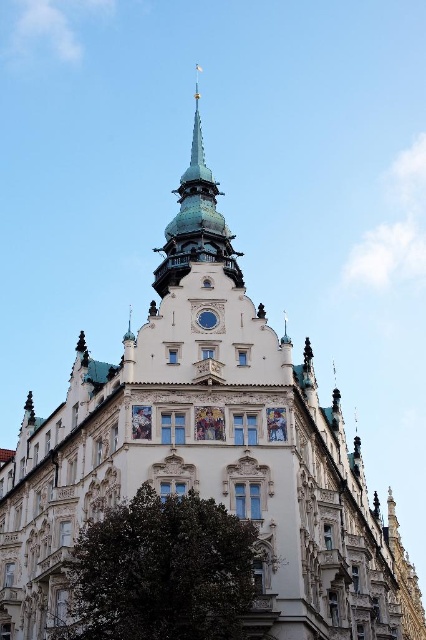
Question: Which object appears farthest from the camera in this image?

Choices:
 (A) blue glass clock at center
 (B) green metallic spire at upper center

Answer: (B)

Question: Which point is closer to the camera?

Choices:
 (A) green metallic spire at upper center
 (B) blue glass clock at center

Answer: (B)

Question: In this image, where is green metallic spire at upper center located relative to blue glass clock at center?

Choices:
 (A) right
 (B) left

Answer: (B)

Question: Which point appears farthest from the camera in this image?

Choices:
 (A) (209, 308)
 (B) (218, 214)

Answer: (B)

Question: Does green metallic spire at upper center come behind blue glass clock at center?

Choices:
 (A) no
 (B) yes

Answer: (B)

Question: Can you confirm if green metallic spire at upper center is bigger than blue glass clock at center?

Choices:
 (A) yes
 (B) no

Answer: (A)